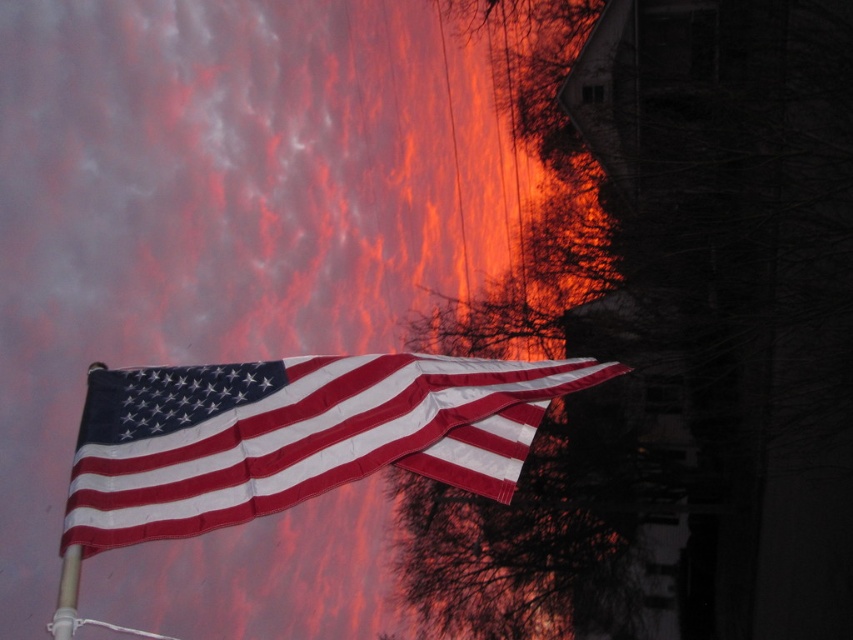
Does matte fabric flag at center have a smaller size compared to white plastic flag pole at lower left?

Actually, matte fabric flag at center might be larger than white plastic flag pole at lower left.

How far apart are matte fabric flag at center and white plastic flag pole at lower left?

A distance of 1.56 meters exists between matte fabric flag at center and white plastic flag pole at lower left.

This screenshot has width=853, height=640. I want to click on matte fabric flag at center, so click(x=294, y=435).

Where is `matte fabric flag at center`? matte fabric flag at center is located at coordinates (294, 435).